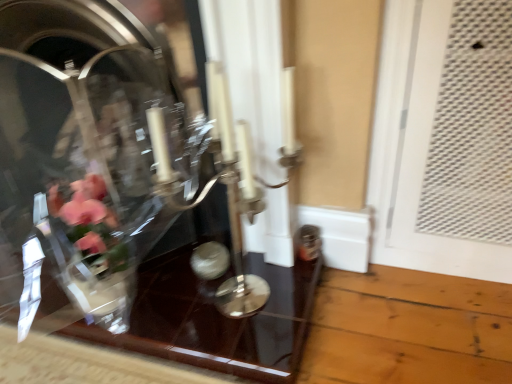
Find the location of a particular element. blank space above transparent glass table at center (from a real-world perspective) is located at coordinates (150, 283).